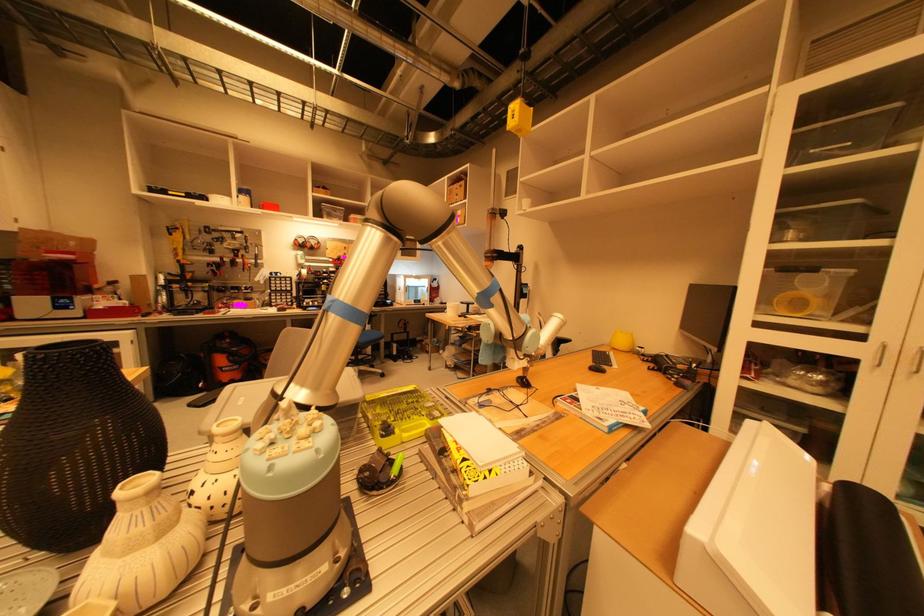
Find the location of `red handled pliers`. red handled pliers is located at coordinates (241, 261).